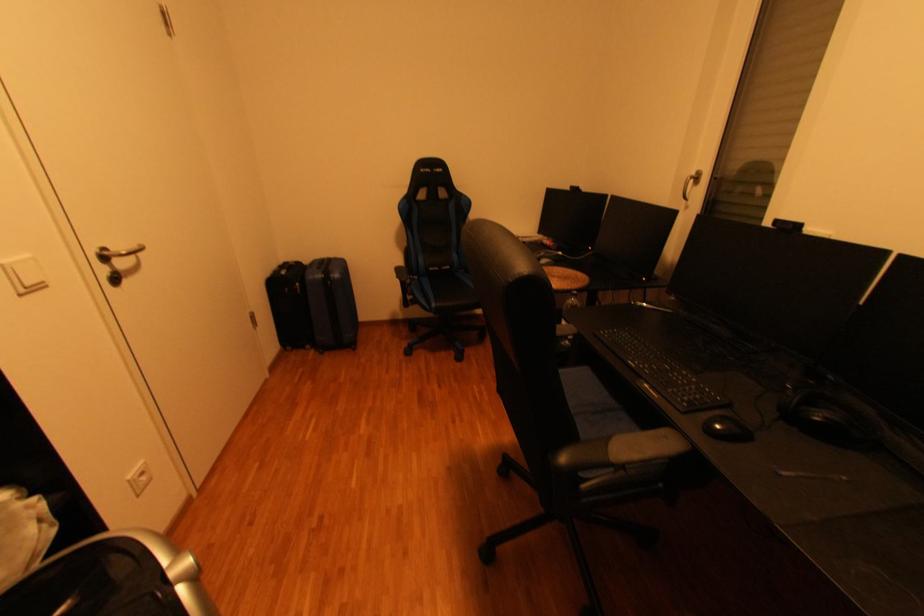
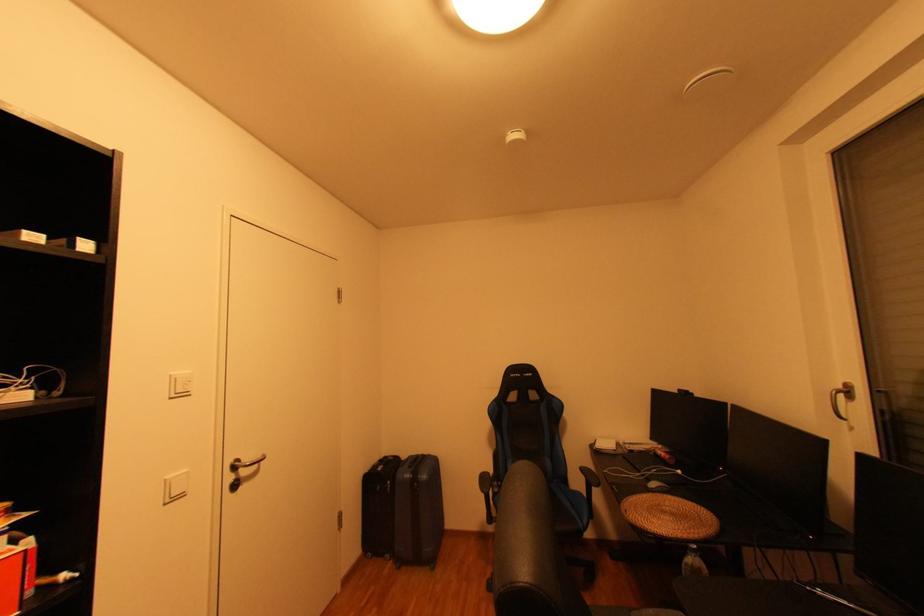
Where in the second image is the point corresponding to the point at 114,249 from the first image?

(247, 461)